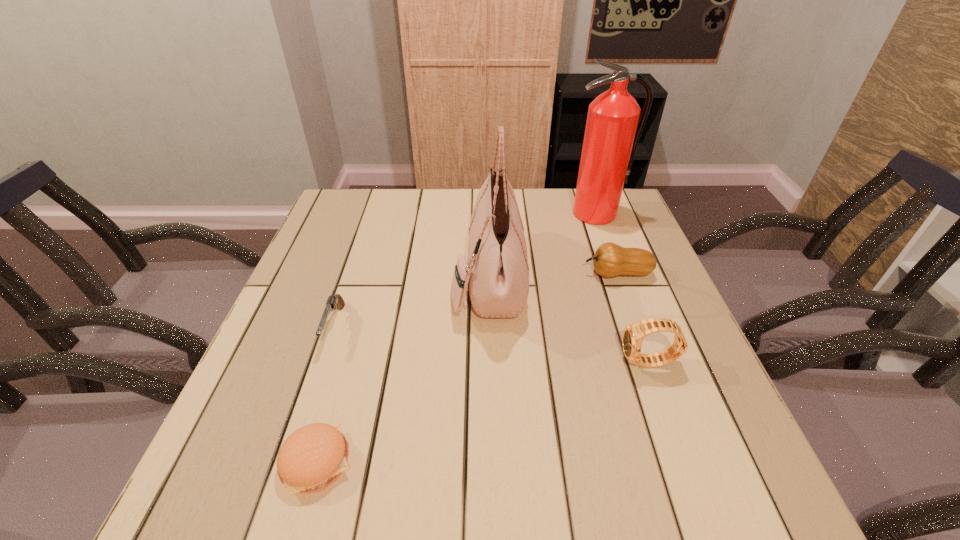
The image size is (960, 540). I want to click on vacant space located 0.110m on the side of the fourth object from right to left with the attached pouch, so click(x=408, y=278).

Find the location of a particular element. This screenshot has height=540, width=960. free space located on the face of the watch is located at coordinates (429, 363).

Locate an element on the screen. free space located 0.180m on the face of the watch is located at coordinates (535, 363).

In order to click on free location located 0.050m on the face of the watch in this screenshot , I will do `click(598, 363)`.

The height and width of the screenshot is (540, 960). Find the location of `vacant point located on the stem side of the third shortest object`. vacant point located on the stem side of the third shortest object is located at coordinates (533, 273).

I want to click on vacant space located 0.350m on the stem side of the third shortest object, so click(446, 273).

Locate an element on the screen. vacant space situated on the stem side of the third shortest object is located at coordinates (552, 273).

Where is `blank space located aiming along the barrel of the gun`? This screenshot has height=540, width=960. blank space located aiming along the barrel of the gun is located at coordinates (305, 413).

Identify the location of blank space located 0.060m on the right of the nearest object. Image resolution: width=960 pixels, height=540 pixels. coord(390,462).

The width and height of the screenshot is (960, 540). I want to click on fire extinguisher situated at the far edge, so click(x=611, y=136).